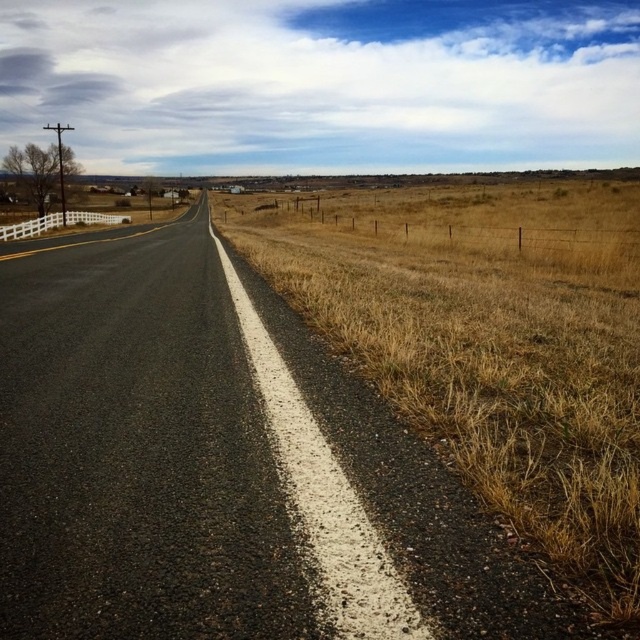
Who is positioned more to the left, black asphalt road at center or dry grass at right?

Positioned to the left is black asphalt road at center.

Measure the distance between point (208, 282) and camera.

The distance of point (208, 282) from camera is 8.41 meters.

Is point (65, 314) closer to camera compared to point (406, 278)?

Yes, it is.

Where is `black asphalt road at center`? Image resolution: width=640 pixels, height=640 pixels. black asphalt road at center is located at coordinates (168, 460).